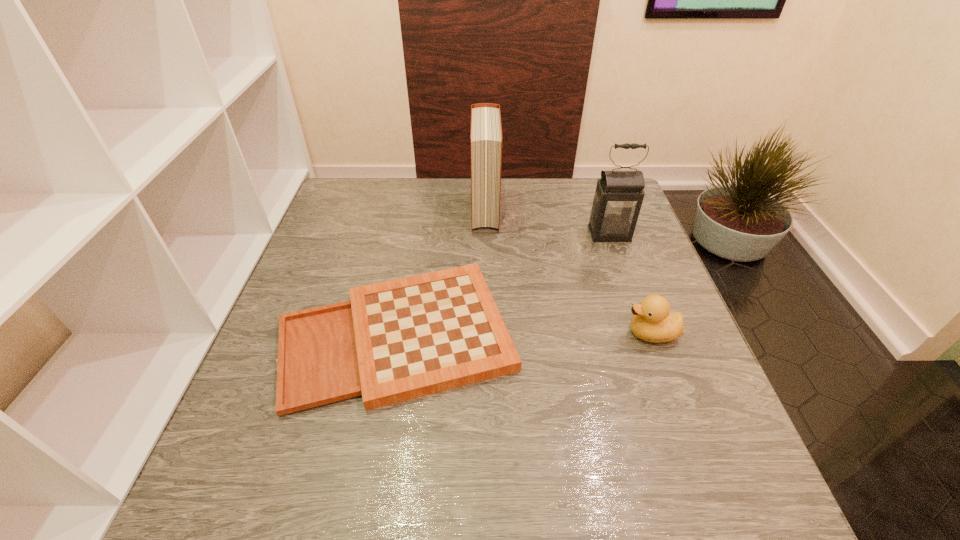
Where is `vacant space in between the gameboard and the lantern`? The width and height of the screenshot is (960, 540). vacant space in between the gameboard and the lantern is located at coordinates (503, 284).

The width and height of the screenshot is (960, 540). I want to click on free spot between the hardback book and the lantern, so click(x=547, y=222).

The width and height of the screenshot is (960, 540). I want to click on free space that is in between the second shortest object and the lantern, so click(630, 284).

I want to click on unoccupied position between the lantern and the hardback book, so click(547, 222).

This screenshot has height=540, width=960. What are the coordinates of `free spot between the lantern and the third tallest object` in the screenshot? It's located at (630, 284).

At what (x,y) coordinates should I click in order to perform the action: click on vacant area that lies between the lantern and the shortest object. Please return your answer as a coordinate pair (x, y). This screenshot has width=960, height=540. Looking at the image, I should click on (503, 284).

I want to click on free area in between the gameboard and the duckling, so click(x=524, y=334).

Locate an element on the screen. This screenshot has width=960, height=540. free point between the hardback book and the lantern is located at coordinates (547, 222).

Identify which object is the third closest to the hardback book. Please provide its 2D coordinates. Your answer should be formatted as a tuple, i.e. [(x, y)], where the tuple contains the x and y coordinates of a point satisfying the conditions above.

[(653, 322)]

The height and width of the screenshot is (540, 960). What are the coordinates of `the closest object to the lantern` in the screenshot? It's located at (393, 341).